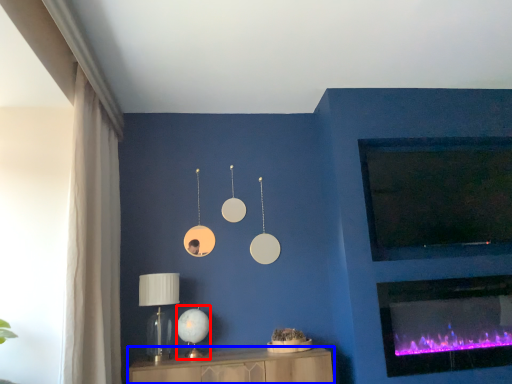
Question: Among these objects, which one is farthest to the camera, table lamp (highlighted by a red box) or furniture (highlighted by a blue box)?

Choices:
 (A) table lamp
 (B) furniture

Answer: (A)